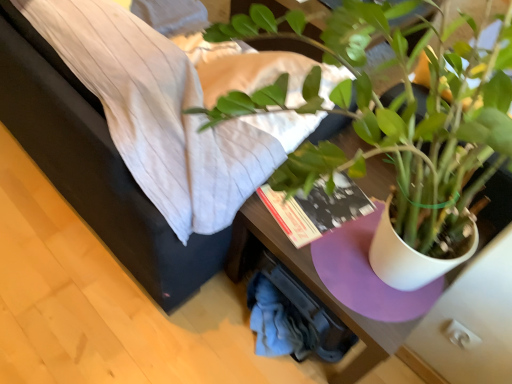
Question: Is green matte plant at center oriented away from white textured sheet at upper center?

Choices:
 (A) no
 (B) yes

Answer: (A)

Question: Can you confirm if green matte plant at center is taller than white textured sheet at upper center?

Choices:
 (A) no
 (B) yes

Answer: (B)

Question: Is white textured sheet at upper center completely or partially inside green matte plant at center?

Choices:
 (A) yes
 (B) no

Answer: (B)

Question: From the image's perspective, is green matte plant at center below white textured sheet at upper center?

Choices:
 (A) yes
 (B) no

Answer: (A)

Question: From a real-world perspective, does green matte plant at center sit lower than white textured sheet at upper center?

Choices:
 (A) no
 (B) yes

Answer: (A)

Question: Could you tell me if green matte plant at center is facing white textured sheet at upper center?

Choices:
 (A) yes
 (B) no

Answer: (B)

Question: Is green matte plant at center completely or partially inside white textured sheet at upper center?

Choices:
 (A) yes
 (B) no

Answer: (B)

Question: Considering the relative sizes of white textured sheet at upper center and green matte plant at center in the image provided, is white textured sheet at upper center shorter than green matte plant at center?

Choices:
 (A) yes
 (B) no

Answer: (A)

Question: Is there a large distance between white textured sheet at upper center and green matte plant at center?

Choices:
 (A) no
 (B) yes

Answer: (A)

Question: Is white textured sheet at upper center next to green matte plant at center?

Choices:
 (A) no
 (B) yes

Answer: (A)

Question: Is white textured sheet at upper center wider than green matte plant at center?

Choices:
 (A) no
 (B) yes

Answer: (B)

Question: Is white textured sheet at upper center looking in the opposite direction of green matte plant at center?

Choices:
 (A) yes
 (B) no

Answer: (B)

Question: From a real-world perspective, is white textured sheet at upper center physically located above or below green matte plant at center?

Choices:
 (A) above
 (B) below

Answer: (B)